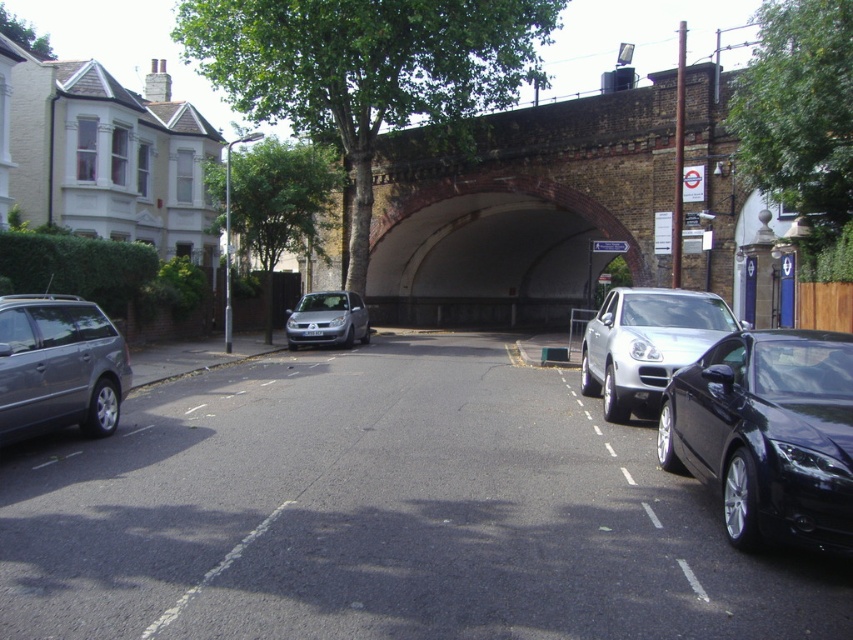
You are driving a car that is 4.5 meters long. You see the brick tunnel at center and the satin silver car at center. Can your car pass through the tunnel at center?

The brick tunnel at center has a larger size compared to the satin silver car at center, so yes, your car can pass through the tunnel at center since it is larger than the car.

You are a delivery person trying to park your truck, which is 2 meters tall, in the street. The road has an archway that is 2.5 meters tall. You notice two vehicles in the scene, a satin silver suv at center and a satin silver car at center. Which vehicle should you use to estimate the clearance of the archway to ensure your truck can pass through?

The satin silver suv at center has a greater height compared to the satin silver car at center. Since your truck is 2 meters tall and the archway is 2.5 meters tall, you should compare your truck height with the taller vehicle, the satin silver suv at center. If the suv can pass under the archway, then your truck should also be able to pass safely.

You are standing at the intersection and need to locate the brick tunnel at center. According to the scene description, where would you find it?

The brick tunnel at center is located at the 2D coordinates point (x=520, y=209).